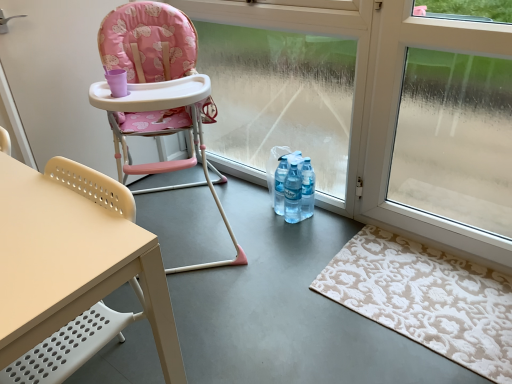
You are a GUI agent. You are given a task and a screenshot of the screen. Output one action in this format:
    pyautogui.click(x=<x>, y=<y>)
    Task: Click on the vacant area situated to the left side of beige textured rug at lower right
    
    Given the screenshot: What is the action you would take?
    pyautogui.click(x=280, y=294)